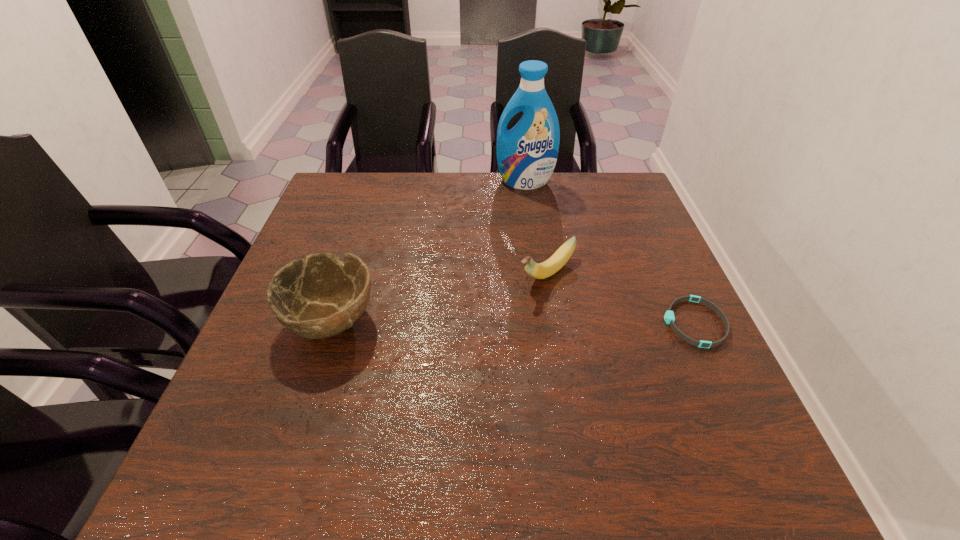
This screenshot has width=960, height=540. I want to click on free space on the desktop that is between the bowl and the rightmost object and is positioned on the front-facing side of the tallest object, so click(497, 321).

Identify the location of free space on the desktop that is between the bowl and the wristband and is positioned at the stem of the banana. This screenshot has height=540, width=960. (487, 321).